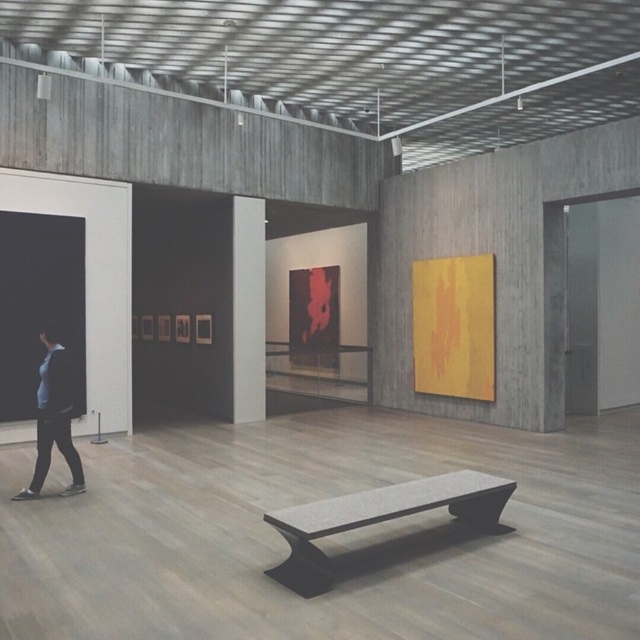
Is granite-like bench at center to the right of dark blue shirt at left from the viewer's perspective?

Indeed, granite-like bench at center is positioned on the right side of dark blue shirt at left.

Consider the image. Is granite-like bench at center positioned in front of dark blue shirt at left?

Yes.

Is point (458, 477) less distant than point (26, 499)?

That is True.

The height and width of the screenshot is (640, 640). Identify the location of granite-like bench at center. (378, 518).